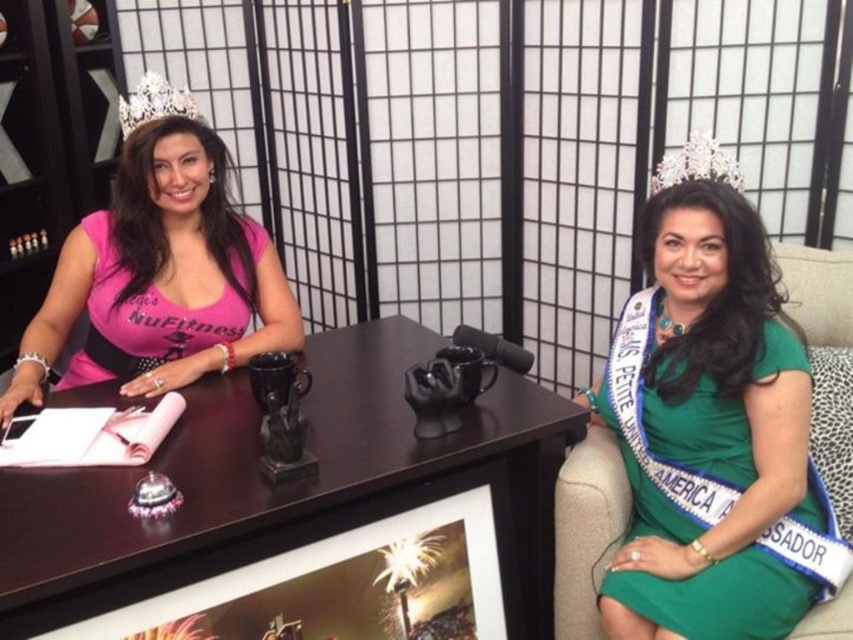
You are a photographer setting up a shoot in the studio. You need to place a 12x12 inch square backdrop stand on the matte black table at center without covering the pink matte shirt at left. Is the table large enough to accommodate both the stand and the shirt?

The matte black table at center has a larger size compared to pink matte shirt at left, so yes, the table is large enough to accommodate both the 12x12 inch square backdrop stand and the pink matte shirt at left without covering the shirt.

You are a photographer setting up for a photo shoot. You have a matte black table at center and a pink matte shirt at left in your frame. Which object is taller?

The pink matte shirt at left is taller than the matte black table at center.

Consider the image. You are a photographer positioned behind the matte black table at center. You want to take a photo of the silver metallic crown at upper left. Can you see the crown clearly without moving your position?

The matte black table at center is closer to the viewer than the silver metallic crown at upper left, so the table will block your view of the crown unless you move your position.